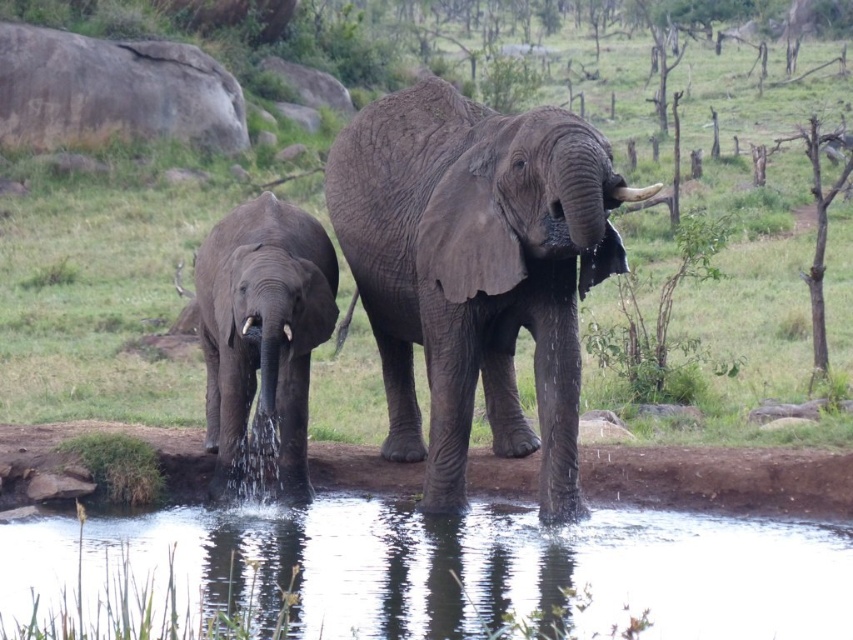
You are a wildlife photographer observing the elephants at the watering hole. You want to capture a photo of the white ivory tusk at upper center without the gray textured elephant at left blocking it. Is this possible based on their positions?

The white ivory tusk at upper center is behind the gray textured elephant at left, so it would be blocked by the elephant in the photo. Adjust your position to get a clear shot around or past the elephant.